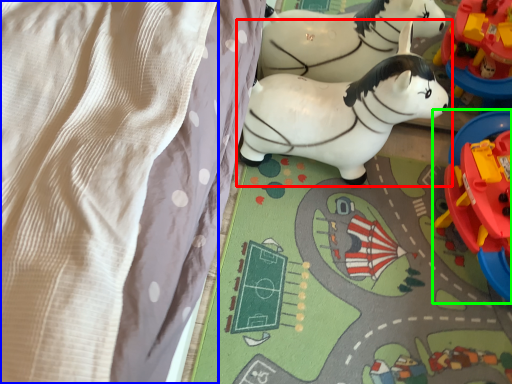
Question: Based on their relative distances, which object is farther from toy (highlighted by a red box)? Choose from blanket (highlighted by a blue box) and toy (highlighted by a green box).

Choices:
 (A) blanket
 (B) toy

Answer: (A)